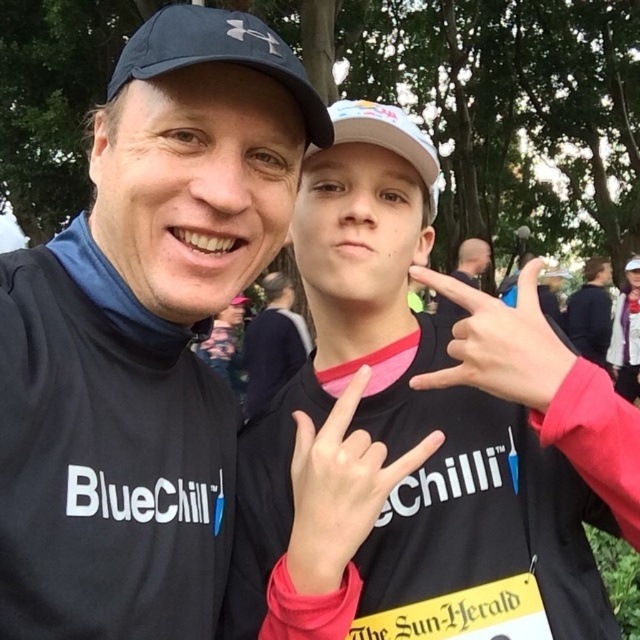
Question: Which of the following is the farthest from the observer?

Choices:
 (A) (545, 348)
 (B) (516, 616)
 (C) (353, 524)

Answer: (B)

Question: Does black matte shirt at center have a smaller size compared to black matte t-shirt at center?

Choices:
 (A) no
 (B) yes

Answer: (A)

Question: Which object appears closest to the camera in this image?

Choices:
 (A) black matte t-shirt at center
 (B) white matte hand at center
 (C) pink matte hand at center

Answer: (A)

Question: Can you confirm if black matte shirt at center is smaller than white matte hand at center?

Choices:
 (A) yes
 (B) no

Answer: (B)

Question: Is the position of black matte t-shirt at center more distant than that of pink matte hand at center?

Choices:
 (A) no
 (B) yes

Answer: (A)

Question: Which of the following is the farthest from the observer?

Choices:
 (A) (356, 224)
 (B) (122, 116)

Answer: (A)